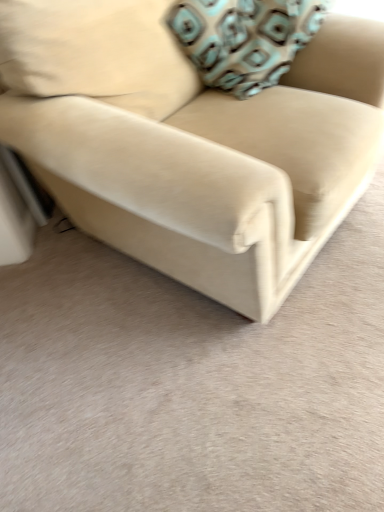
Identify the location of free space in front of beige fabric couch at center. (205, 394).